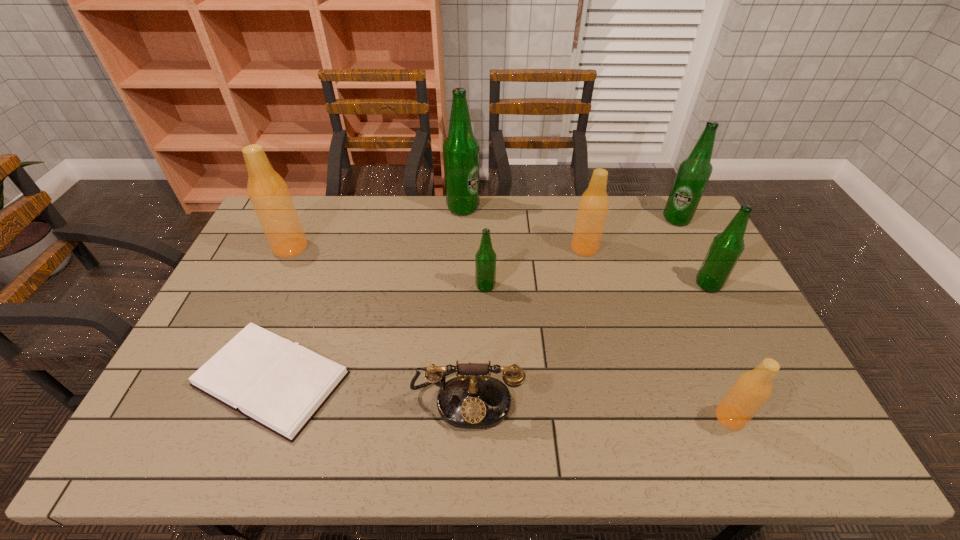
Identify the location of vacant space that satisfies the following two spatial constraints: 1. on the front side of the biggest tan beer bottle; 2. on the left side of the nearest beer bottle. The height and width of the screenshot is (540, 960). (212, 417).

What are the coordinates of `vacant area in the image that satisfies the following two spatial constraints: 1. on the back side of the fourth beer bottle from right to left; 2. on the label of the tallest object` in the screenshot? It's located at (574, 208).

Locate an element on the screen. free point that satisfies the following two spatial constraints: 1. on the label of the rightmost tan beer bottle; 2. on the left side of the tallest beer bottle is located at coordinates (453, 417).

In order to click on vacant region that satisfies the following two spatial constraints: 1. on the label of the third beer bottle from right to left; 2. on the right side of the tallest object in this screenshot , I will do `click(453, 417)`.

You are a GUI agent. You are given a task and a screenshot of the screen. Output one action in this format:
    pyautogui.click(x=<x>, y=<y>)
    Task: Click on the vacant region that satisfies the following two spatial constraints: 1. on the label of the second smallest green beer bottle; 2. on the dial of the telephone
    
    Given the screenshot: What is the action you would take?
    pyautogui.click(x=764, y=396)